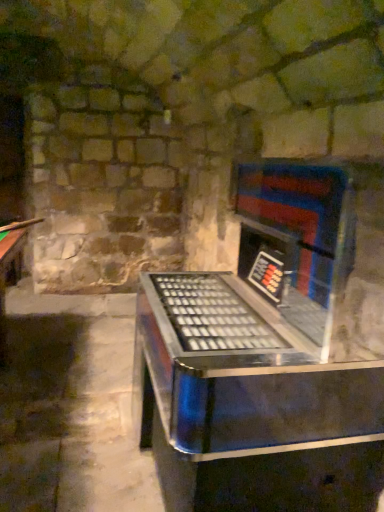
This screenshot has width=384, height=512. What do you see at coordinates (20, 224) in the screenshot?
I see `brushed metal cue at left` at bounding box center [20, 224].

Find the location of a particular element. The image size is (384, 512). brushed metal cue at left is located at coordinates (20, 224).

What is the approximate width of brushed metal cue at left?

It is 19.85 inches.

What is the approximate height of metallic/reflective jukebox at center?

The height of metallic/reflective jukebox at center is 1.37 meters.

What do you see at coordinates (270, 353) in the screenshot?
I see `metallic/reflective jukebox at center` at bounding box center [270, 353].

Find the location of a particular element. metallic/reflective jukebox at center is located at coordinates (270, 353).

Where is `brushed metal cue at left`? The height and width of the screenshot is (512, 384). brushed metal cue at left is located at coordinates (20, 224).

Considering the relative positions of metallic/reflective jukebox at center and brushed metal cue at left in the image provided, is metallic/reflective jukebox at center to the right of brushed metal cue at left from the viewer's perspective?

Yes.

Which object is more forward, metallic/reflective jukebox at center or brushed metal cue at left?

metallic/reflective jukebox at center is in front.

Is point (155, 343) farther from viewer compared to point (29, 222)?

That is False.

From the image's perspective, between metallic/reflective jukebox at center and brushed metal cue at left, who is located below?

metallic/reflective jukebox at center.

From a real-world perspective, which is physically above, metallic/reflective jukebox at center or brushed metal cue at left?

In real-world perspective, brushed metal cue at left is above.

Considering the sizes of objects metallic/reflective jukebox at center and brushed metal cue at left in the image provided, who is wider, metallic/reflective jukebox at center or brushed metal cue at left?

metallic/reflective jukebox at center.

Between metallic/reflective jukebox at center and brushed metal cue at left, which one has less height?

brushed metal cue at left.

Which of these two, metallic/reflective jukebox at center or brushed metal cue at left, is smaller?

Smaller between the two is brushed metal cue at left.

Which is correct: metallic/reflective jukebox at center is inside brushed metal cue at left, or outside of it?

Result: metallic/reflective jukebox at center is outside brushed metal cue at left.

Is metallic/reflective jukebox at center not near brushed metal cue at left?

metallic/reflective jukebox at center is far away from brushed metal cue at left.

Is metallic/reflective jukebox at center oriented towards brushed metal cue at left?

No, metallic/reflective jukebox at center is not turned towards brushed metal cue at left.

From the picture: How different are the orientations of metallic/reflective jukebox at center and brushed metal cue at left in degrees?

They differ by 62.3 degrees in their facing directions.

Find the location of a particular element. furniture below the brushed metal cue at left (from a real-world perspective) is located at coordinates (270, 353).

Can you confirm if brushed metal cue at left is positioned to the right of metallic/reflective jukebox at center?

No.

In the image, is brushed metal cue at left positioned in front of or behind metallic/reflective jukebox at center?

Visually, brushed metal cue at left is located behind metallic/reflective jukebox at center.

Does point (24, 223) appear closer or farther from the camera than point (272, 344)?

Point (24, 223) is farther from the camera than point (272, 344).

From the image's perspective, is brushed metal cue at left located above or below metallic/reflective jukebox at center?

brushed metal cue at left is situated higher than metallic/reflective jukebox at center in the image.

From a real-world perspective, relative to metallic/reflective jukebox at center, is brushed metal cue at left vertically above or below?

brushed metal cue at left is above metallic/reflective jukebox at center.

Considering the sizes of objects brushed metal cue at left and metallic/reflective jukebox at center in the image provided, who is wider, brushed metal cue at left or metallic/reflective jukebox at center?

metallic/reflective jukebox at center is wider.

In the scene shown: Can you confirm if brushed metal cue at left is shorter than metallic/reflective jukebox at center?

Yes.

Which of these two, brushed metal cue at left or metallic/reflective jukebox at center, is bigger?

Bigger between the two is metallic/reflective jukebox at center.

Would you say brushed metal cue at left is outside metallic/reflective jukebox at center?

Yes.

Is brushed metal cue at left in contact with metallic/reflective jukebox at center?

brushed metal cue at left and metallic/reflective jukebox at center are clearly separated.

Could you tell me if brushed metal cue at left is facing metallic/reflective jukebox at center?

No, brushed metal cue at left is not turned towards metallic/reflective jukebox at center.

The width and height of the screenshot is (384, 512). Find the location of `furniture on the right of brushed metal cue at left`. furniture on the right of brushed metal cue at left is located at coordinates (270, 353).

I want to click on furniture below the brushed metal cue at left (from the image's perspective), so click(270, 353).

Locate an element on the screen. This screenshot has height=512, width=384. furniture that appears on the right of brushed metal cue at left is located at coordinates (270, 353).